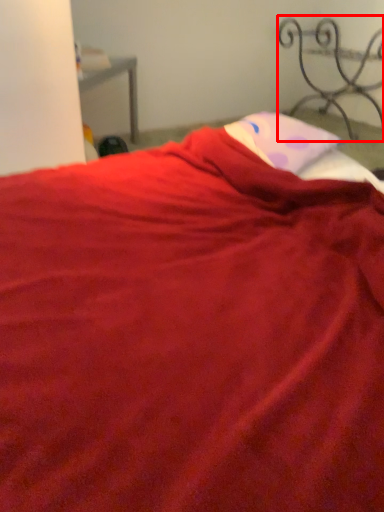
Question: From the image, what is the correct spatial relationship of furniture (annotated by the red box) in relation to pillow?

Choices:
 (A) left
 (B) right

Answer: (B)